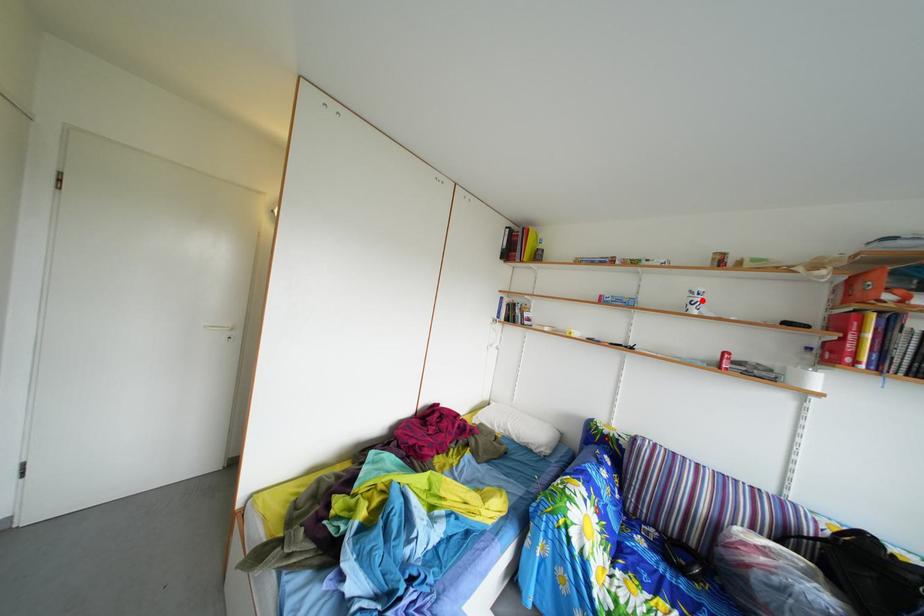
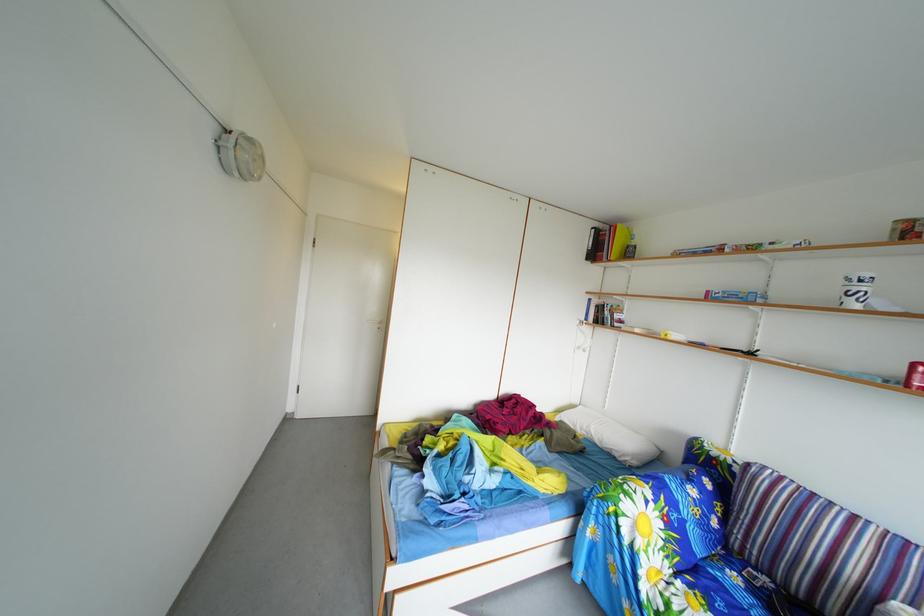
Find the pixel in the second image that matches the highlighted location in the first image.

(859, 288)